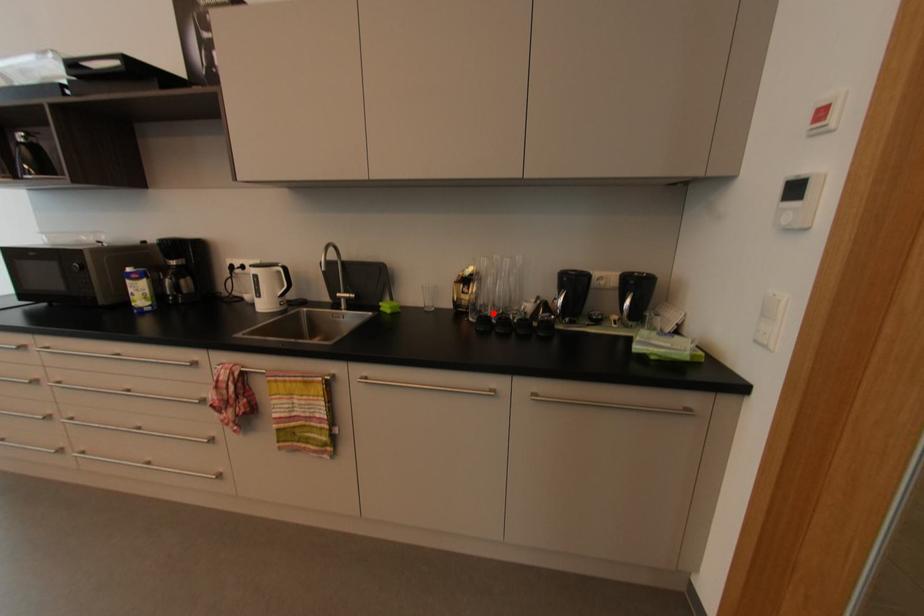
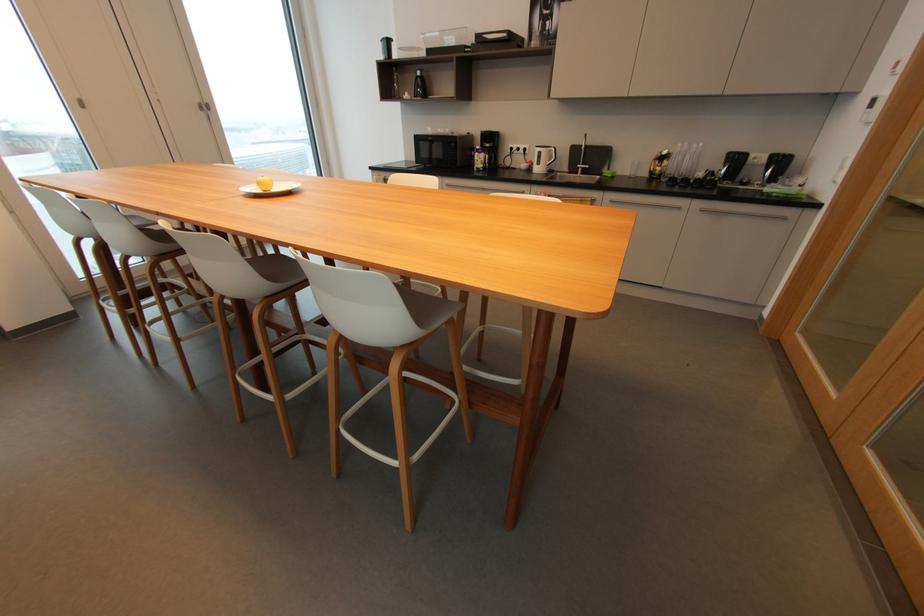
The point at the highlighted location is marked in the first image. Where is the corresponding point in the second image?

(678, 177)